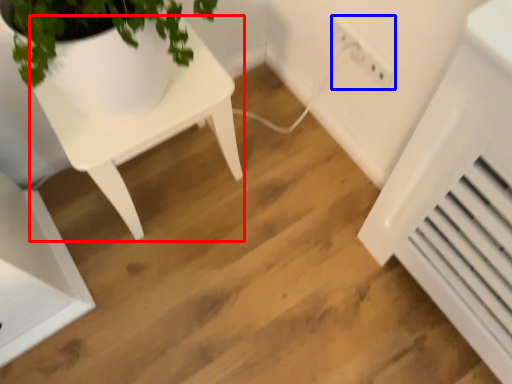
Question: Which object is further to the camera taking this photo, table (highlighted by a red box) or electric outlet (highlighted by a blue box)?

Choices:
 (A) table
 (B) electric outlet

Answer: (B)